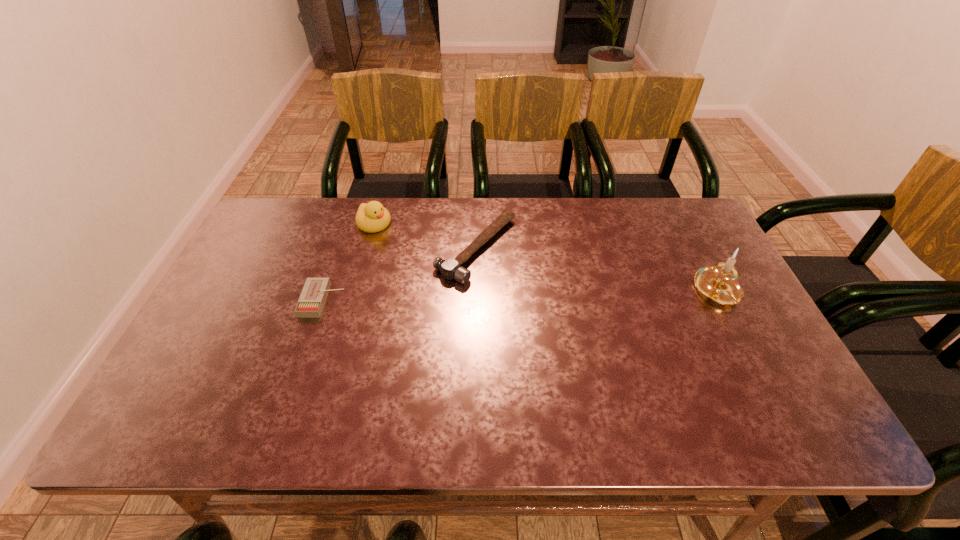
The width and height of the screenshot is (960, 540). Identify the location of vacant space on the desktop that is between the matchbox and the rightmost object and is positioned on the striking face of the third object from left to right. (575, 295).

This screenshot has height=540, width=960. What are the coordinates of `free spot on the desktop that is between the shortest object and the rightmost object and is positioned on the face of the duckling` in the screenshot? It's located at (469, 297).